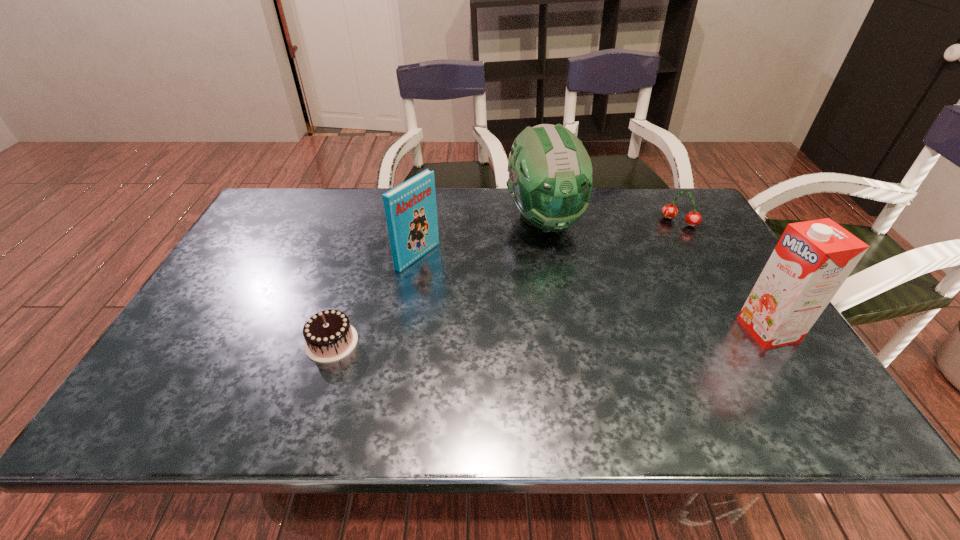
Where is `vacant space that is in between the leftmost object and the carton`? This screenshot has height=540, width=960. vacant space that is in between the leftmost object and the carton is located at coordinates (550, 336).

Locate which object is the third closest to the third object from right to left. Please provide its 2D coordinates. Your answer should be formatted as a tuple, i.e. [(x, y)], where the tuple contains the x and y coordinates of a point satisfying the conditions above.

[(811, 261)]

Identify which object is the fourth closest to the football helmet. Please provide its 2D coordinates. Your answer should be formatted as a tuple, i.e. [(x, y)], where the tuple contains the x and y coordinates of a point satisfying the conditions above.

[(329, 337)]

This screenshot has width=960, height=540. I want to click on vacant space that satisfies the following two spatial constraints: 1. on the back side of the carton; 2. on the left side of the chocolate cake, so click(x=335, y=330).

The image size is (960, 540). Identify the location of free space that satisfies the following two spatial constraints: 1. on the front side of the football helmet; 2. on the left side of the carton. (564, 330).

Find the location of a particular element. This screenshot has width=960, height=540. free location that satisfies the following two spatial constraints: 1. on the back side of the third tallest object; 2. on the left side of the cherry is located at coordinates (423, 222).

Identify the location of free location that satisfies the following two spatial constraints: 1. on the back side of the leftmost object; 2. on the right side of the book. This screenshot has height=540, width=960. pyautogui.click(x=359, y=256).

The height and width of the screenshot is (540, 960). I want to click on vacant space that satisfies the following two spatial constraints: 1. on the back side of the second shortest object; 2. on the left side of the chocolate cake, so click(370, 222).